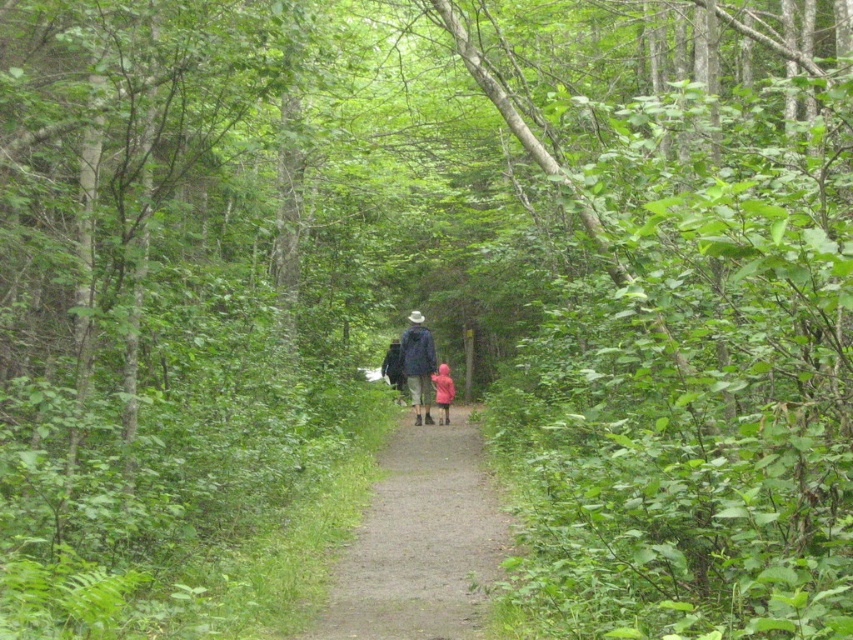
You are standing at the starting point of the dirt path at center. If you walk straight ahead, will you eventually reach the two figures walking away from you along the path?

Yes, because the dirt path at center is a continuous trail leading towards the two figures walking away from you along the path.

You are a hiker carrying a backpack and see the dirt path at center and the pink matte jacket at center. Which object takes up more space in the image?

The dirt path at center is larger in size than the pink matte jacket at center, so the dirt path at center takes up more space in the image.

You are standing at the camera position and want to walk along the dirt path at center to reach a cabin located 10 meters ahead. Can you walk straight ahead without deviating from the path?

The dirt path at center is 7.15 meters from camera, so yes, you can walk straight ahead without deviating from the path since the cabin is only 10 meters away and the path is already in front of you.